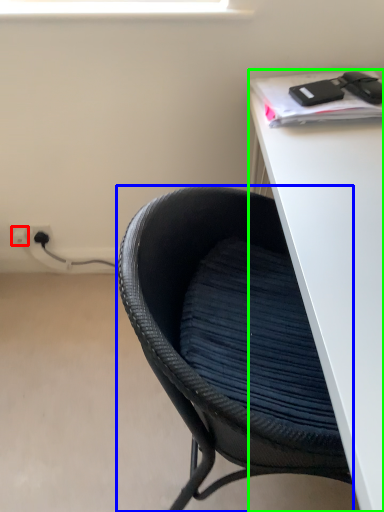
Question: Which is nearer to the electric outlet (highlighted by a red box)? chair (highlighted by a blue box) or desk (highlighted by a green box).

Choices:
 (A) chair
 (B) desk

Answer: (A)